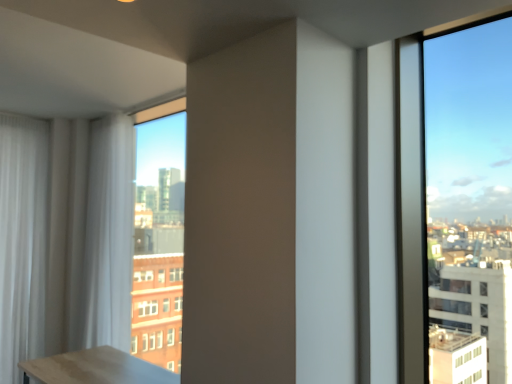
Question: In terms of height, does white sheer curtain at left, which is counted as the first curtain, starting from the right, look taller or shorter compared to white sheer curtain at left, acting as the 2th curtain starting from the right?

Choices:
 (A) tall
 (B) short

Answer: (B)

Question: Is white sheer curtain at left, which is the second curtain from left to right, bigger or smaller than white sheer curtain at left, marked as the 1th curtain in a left-to-right arrangement?

Choices:
 (A) small
 (B) big

Answer: (B)

Question: From the image's perspective, is white sheer curtain at left, which is counted as the first curtain, starting from the right, above or below white sheer curtain at left, marked as the 1th curtain in a left-to-right arrangement?

Choices:
 (A) above
 (B) below

Answer: (A)

Question: Is white sheer curtain at left, acting as the 2th curtain starting from the right, taller or shorter than white sheer curtain at left, which is counted as the first curtain, starting from the right?

Choices:
 (A) short
 (B) tall

Answer: (B)

Question: From the image's perspective, is white sheer curtain at left, marked as the 1th curtain in a left-to-right arrangement, located above or below white sheer curtain at left, which is counted as the first curtain, starting from the right?

Choices:
 (A) below
 (B) above

Answer: (A)

Question: From a real-world perspective, relative to white sheer curtain at left, which is the second curtain from left to right, is white sheer curtain at left, acting as the 2th curtain starting from the right, vertically above or below?

Choices:
 (A) above
 (B) below

Answer: (B)

Question: Would you say white sheer curtain at left, acting as the 2th curtain starting from the right, is inside or outside white sheer curtain at left, which is the second curtain from left to right?

Choices:
 (A) outside
 (B) inside

Answer: (A)